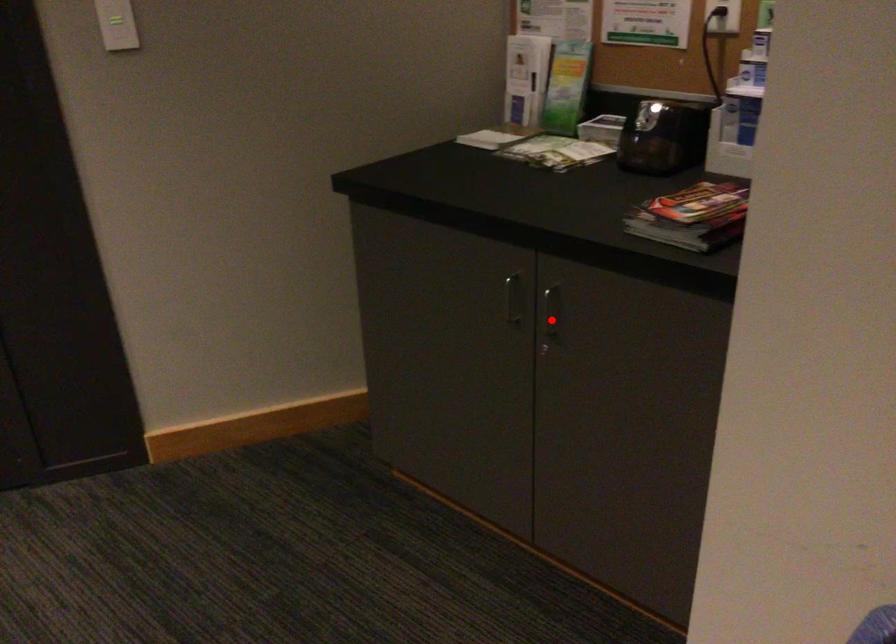
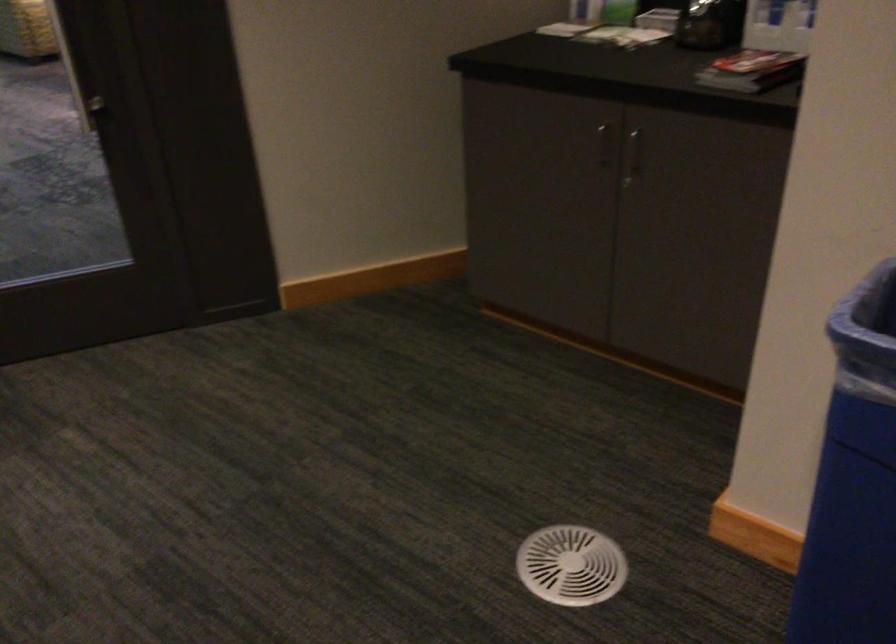
Question: I am providing you with two images of the same scene from different viewpoints. A red point is shown in image1. For the corresponding object point in image2, is it positioned nearer or farther from the camera?

Choices:
 (A) Nearer
 (B) Farther

Answer: (B)